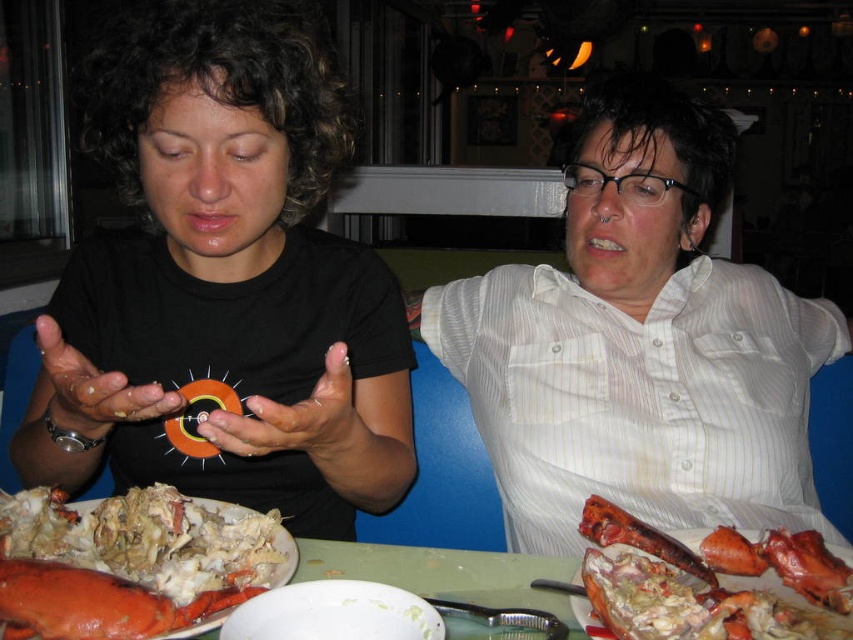
You are a delivery person who needs to place a small package between the black matte shirt at center and the orange plastic ring at center. The package is 8 inches long. Can you fit it between them without moving either object?

The distance between the black matte shirt at center and the orange plastic ring at center is 7.19 inches. Since the package is 8 inches long, which is longer than the available space, it cannot be placed between them without moving either object.

You are a server at a seafood restaurant. You need to place a new drink order between the shiny lobster claw at lower left and the orange plastic ring at center. The drink is 10 centimeters wide. Can you fit it there?

The distance between the shiny lobster claw at lower left and the orange plastic ring at center is 13.81 centimeters. Since the drink is 10 centimeters wide, there is enough space to place it between them.